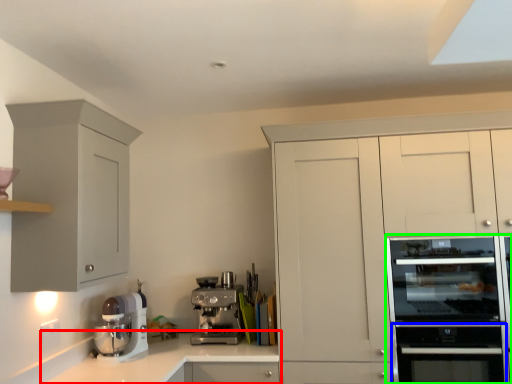
Question: Which object is the closest to the countertop (highlighted by a red box)? Choose among these: oven (highlighted by a blue box) or home appliance (highlighted by a green box).

Choices:
 (A) oven
 (B) home appliance

Answer: (A)